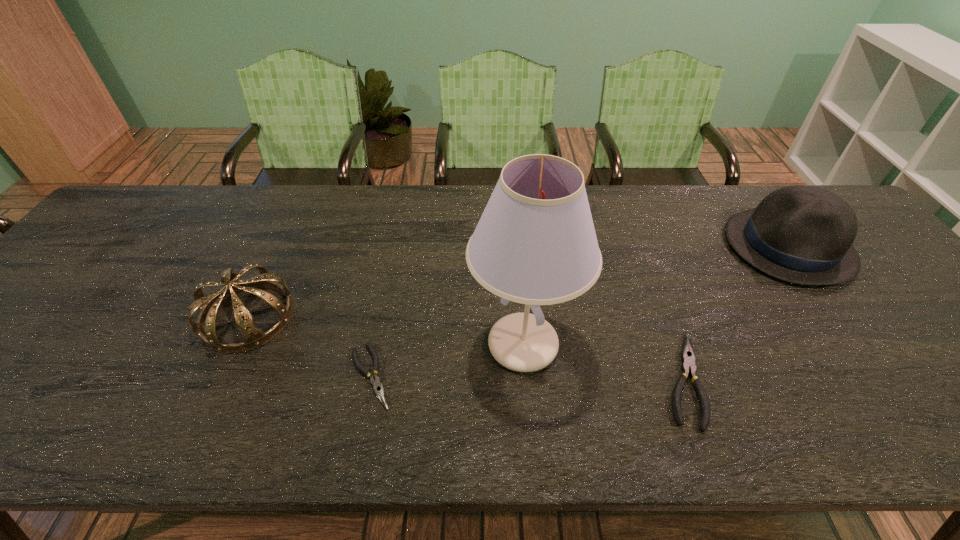
The height and width of the screenshot is (540, 960). In order to click on vacant position located 0.130m on the back of the second shortest object in this screenshot , I will do `click(651, 292)`.

In order to click on free location located 0.360m on the right of the tiara in this screenshot , I will do click(x=444, y=317).

I want to click on free space located on the front-facing side of the rightmost object, so click(x=675, y=246).

Image resolution: width=960 pixels, height=540 pixels. I want to click on vacant space located on the front-facing side of the rightmost object, so click(x=696, y=246).

What are the coordinates of `vacant space located on the front-facing side of the rightmost object` in the screenshot? It's located at (592, 246).

I want to click on vacant space located on the left of the lampshade, so click(x=442, y=345).

At what (x,y) coordinates should I click in order to perform the action: click on object that is positioned at the far edge. Please return your answer as a coordinate pair (x, y). The width and height of the screenshot is (960, 540). Looking at the image, I should click on (801, 234).

Image resolution: width=960 pixels, height=540 pixels. What are the coordinates of `lampshade situated at the near edge` in the screenshot? It's located at (535, 244).

Find the location of a particular element. This screenshot has height=540, width=960. object at the right edge is located at coordinates (801, 234).

Where is `object that is at the far right corner`? The height and width of the screenshot is (540, 960). object that is at the far right corner is located at coordinates (801, 234).